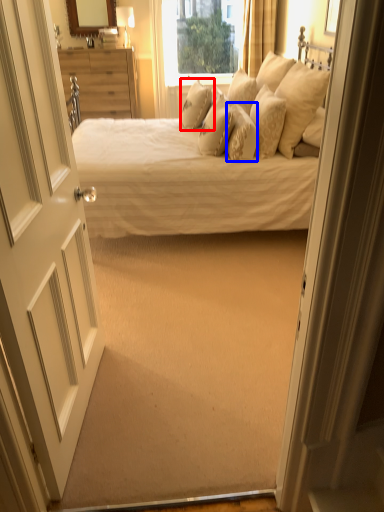
Question: Which object is closer to the camera taking this photo, pillow (highlighted by a red box) or pillow (highlighted by a blue box)?

Choices:
 (A) pillow
 (B) pillow

Answer: (B)